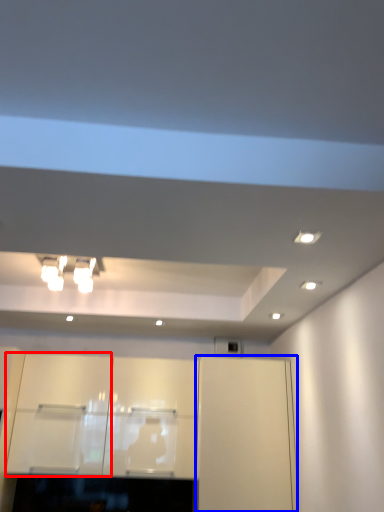
Question: Which point is further to the camera, cabinetry (highlighted by a red box) or cabinetry (highlighted by a blue box)?

Choices:
 (A) cabinetry
 (B) cabinetry

Answer: (A)